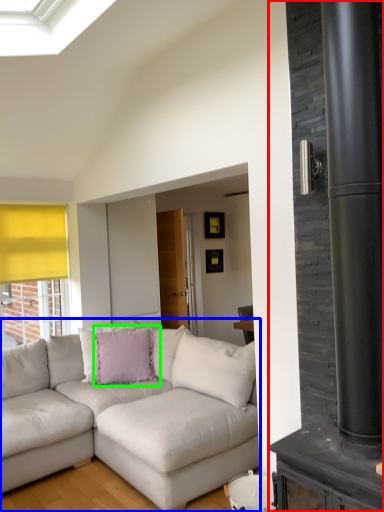
Question: Considering the real-world distances, which object is farthest from fireplace (highlighted by a red box)? studio couch (highlighted by a blue box) or pillow (highlighted by a green box)?

Choices:
 (A) studio couch
 (B) pillow

Answer: (B)